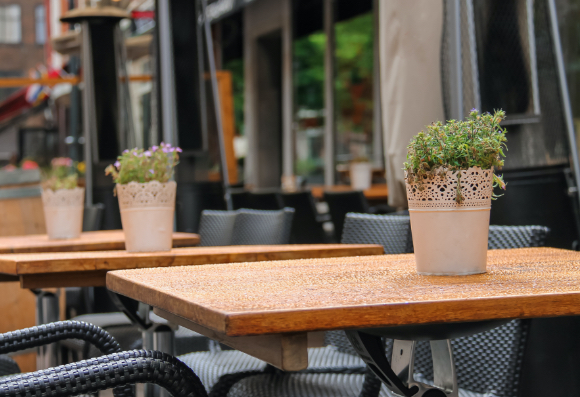
I want to click on table decorations, so click(x=449, y=219), click(x=447, y=188), click(x=153, y=218), click(x=157, y=167), click(x=68, y=221), click(x=68, y=178).